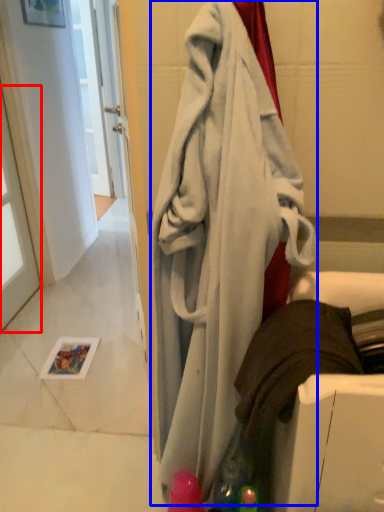
Question: Which of the following is the closest to the observer, window (highlighted by a red box) or towel (highlighted by a blue box)?

Choices:
 (A) window
 (B) towel

Answer: (B)